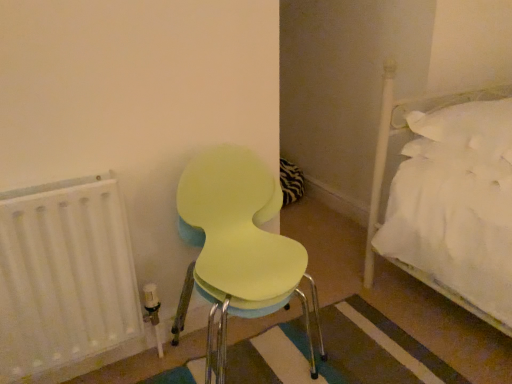
Question: From a real-world perspective, is light yellow plastic chair at center-left above or below white matte radiator at left?

Choices:
 (A) above
 (B) below

Answer: (A)

Question: From the image's perspective, is light yellow plastic chair at center-left located above or below white matte radiator at left?

Choices:
 (A) above
 (B) below

Answer: (A)

Question: Considering their positions, is light yellow plastic chair at center-left located in front of or behind white matte radiator at left?

Choices:
 (A) behind
 (B) front

Answer: (B)

Question: Is white matte radiator at left taller or shorter than light yellow plastic chair at center-left?

Choices:
 (A) tall
 (B) short

Answer: (B)

Question: From the image's perspective, relative to light yellow plastic chair at center-left, is white matte radiator at left above or below?

Choices:
 (A) above
 (B) below

Answer: (B)

Question: From a real-world perspective, is white matte radiator at left physically located above or below light yellow plastic chair at center-left?

Choices:
 (A) above
 (B) below

Answer: (B)

Question: Is white matte radiator at left inside the boundaries of light yellow plastic chair at center-left, or outside?

Choices:
 (A) outside
 (B) inside

Answer: (A)